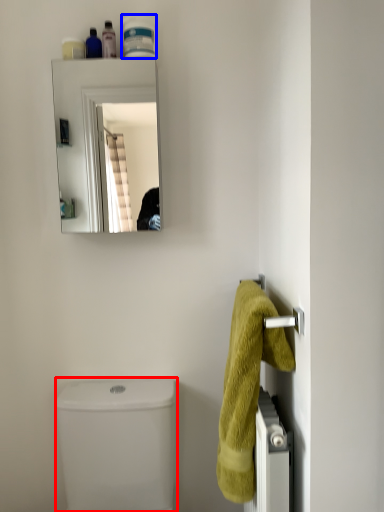
Question: Which of the following is the farthest to the observer, toilet bowl (highlighted by a red box) or toiletry (highlighted by a blue box)?

Choices:
 (A) toilet bowl
 (B) toiletry

Answer: (B)